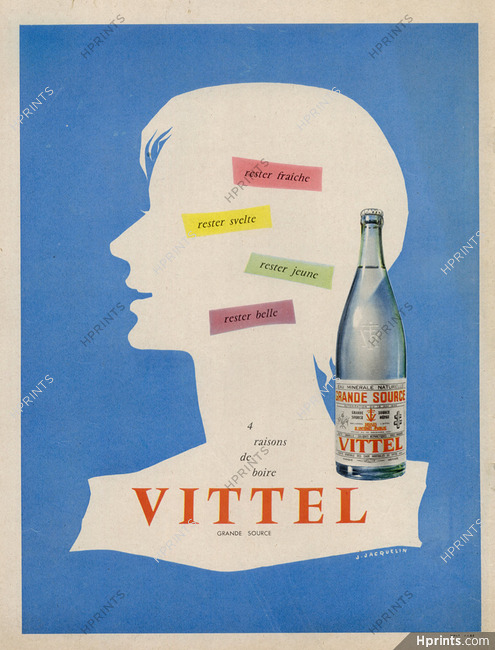
What are the coordinates of `bottle` in the screenshot? It's located at (373, 340).